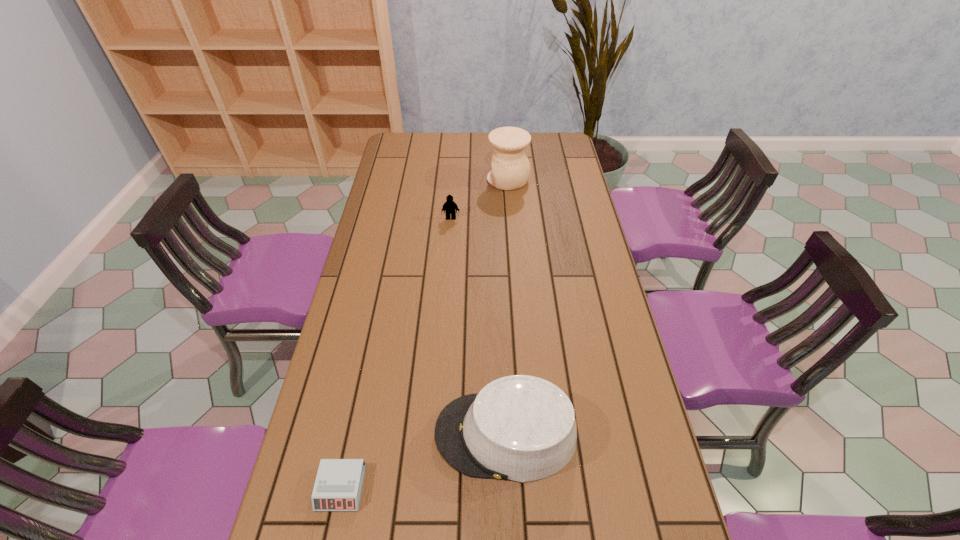
Where is `free space located on the front-facing side of the third shortest object`? The image size is (960, 540). free space located on the front-facing side of the third shortest object is located at coordinates (314, 434).

Locate an element on the screen. The height and width of the screenshot is (540, 960). blank area located on the front-facing side of the third shortest object is located at coordinates (382, 434).

Find the location of a particular element. The width and height of the screenshot is (960, 540). vacant space located on the front-facing side of the third shortest object is located at coordinates (374, 434).

Locate an element on the screen. The width and height of the screenshot is (960, 540). free space located 0.140m on the face of the third nearest object is located at coordinates (449, 245).

You are a GUI agent. You are given a task and a screenshot of the screen. Output one action in this format:
    pyautogui.click(x=<x>, y=<y>)
    Task: Click on the blank space located on the back of the shortest object
    
    Given the screenshot: What is the action you would take?
    point(361,392)

At what (x,y) coordinates should I click in order to perform the action: click on object present at the left edge. Please return your answer as a coordinate pair (x, y). This screenshot has height=540, width=960. Looking at the image, I should click on (338, 485).

This screenshot has height=540, width=960. Identify the location of vacant space at the far edge. (477, 138).

Image resolution: width=960 pixels, height=540 pixels. In the image, there is a desktop. Find the location of `vacant space at the left edge`. vacant space at the left edge is located at coordinates (372, 417).

You are a GUI agent. You are given a task and a screenshot of the screen. Output one action in this format:
    pyautogui.click(x=<x>, y=<y>)
    Task: Click on the vacant space at the right edge of the desktop
    This screenshot has width=960, height=540.
    Given the screenshot: What is the action you would take?
    pyautogui.click(x=653, y=497)

The width and height of the screenshot is (960, 540). I want to click on free space between the alarm clock and the third shortest object, so click(423, 461).